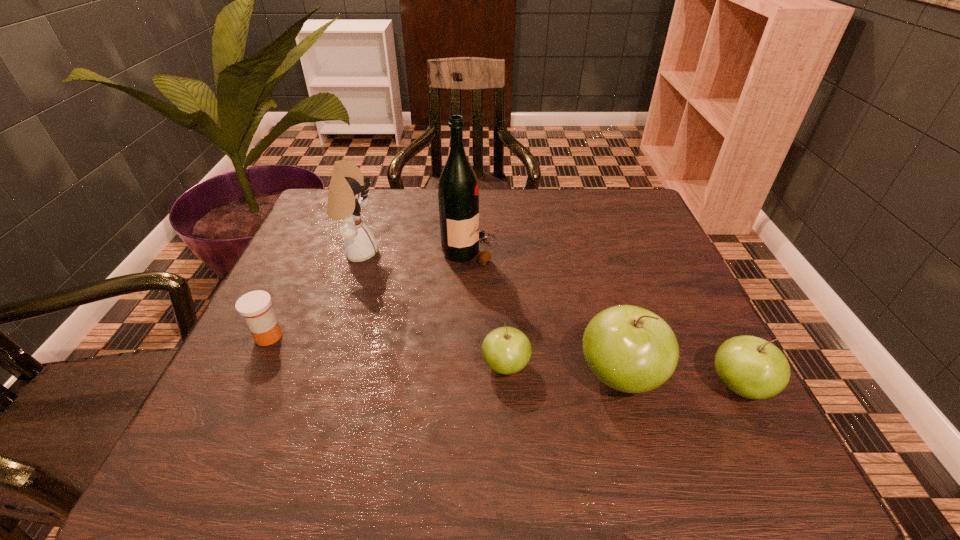
Identify the location of the leftmost apple. Image resolution: width=960 pixels, height=540 pixels. [506, 350].

Image resolution: width=960 pixels, height=540 pixels. I want to click on the second apple from left to right, so click(x=630, y=349).

This screenshot has height=540, width=960. Find the location of `the tallest apple`. the tallest apple is located at coordinates (630, 349).

The image size is (960, 540). I want to click on the rightmost object, so click(751, 367).

You are a GUI agent. You are given a task and a screenshot of the screen. Output one action in this format:
    pyautogui.click(x=<x>, y=<y>)
    Task: Click on the rightmost apple
    
    Given the screenshot: What is the action you would take?
    pyautogui.click(x=751, y=367)

Find the location of `the tallest object`. the tallest object is located at coordinates (458, 195).

Where is `the second object from left to right`? This screenshot has width=960, height=540. the second object from left to right is located at coordinates (347, 195).

The height and width of the screenshot is (540, 960). I want to click on doll, so click(347, 195).

Locate an element on the screen. This screenshot has height=540, width=960. the leftmost object is located at coordinates (255, 307).

The width and height of the screenshot is (960, 540). I want to click on blank space located 0.220m on the left of the shortest apple, so tap(364, 366).